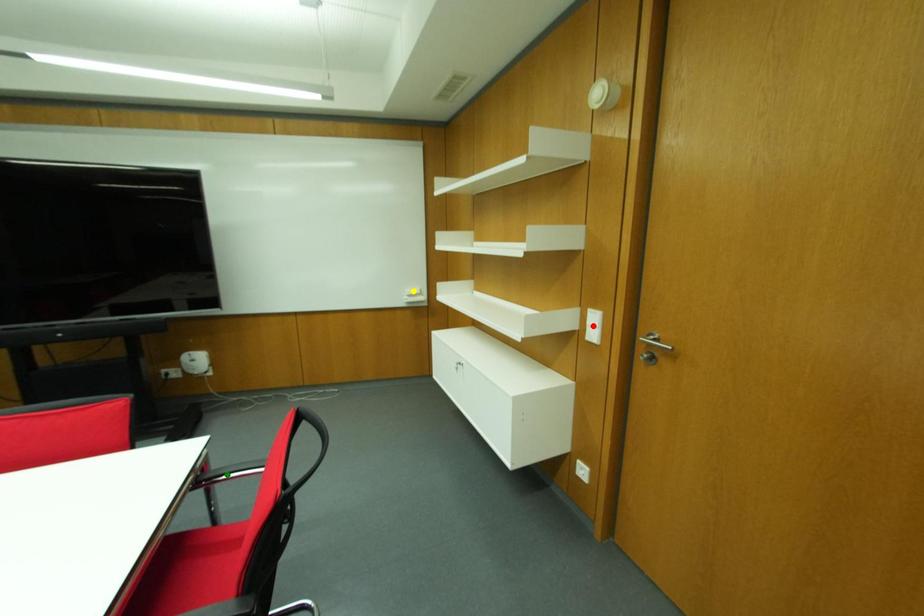
Order these from nearest to farthest:
red point, yellow point, green point

1. green point
2. red point
3. yellow point